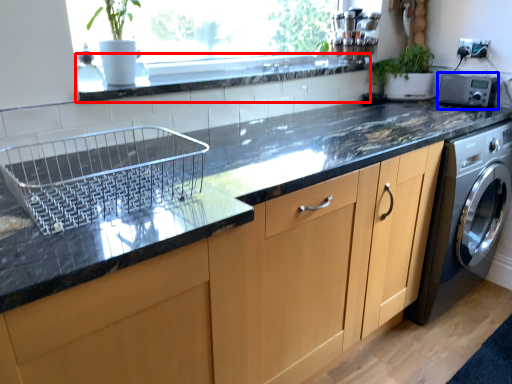
Question: Which object appears closest to the camera in this image, window sill (highlighted by a red box) or appliance (highlighted by a blue box)?

Choices:
 (A) window sill
 (B) appliance

Answer: (A)